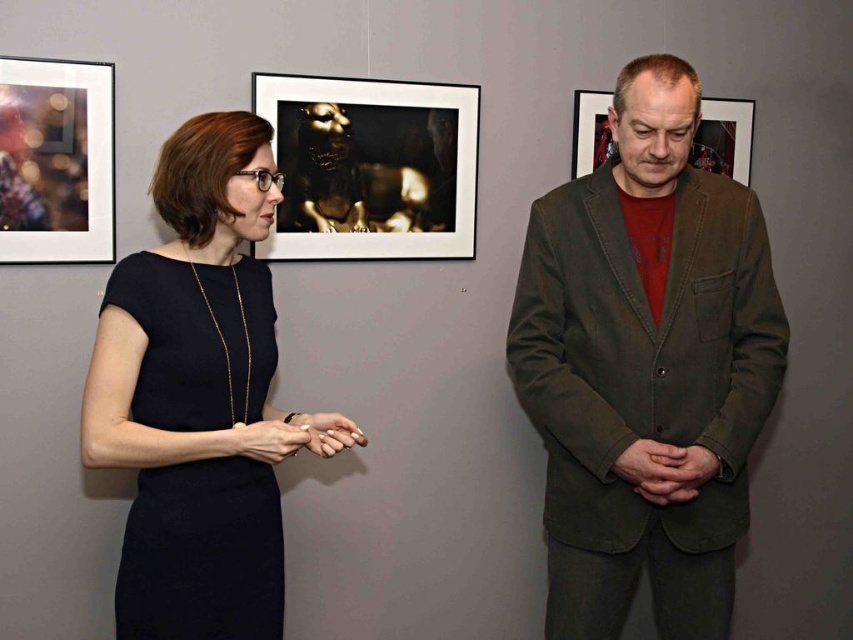
Question: Among these points, which one is farthest from the camera?

Choices:
 (A) (640, 275)
 (B) (265, 456)
 (C) (260, 243)

Answer: (C)

Question: Which of the following is the closest to the observer?

Choices:
 (A) metallic glass frame at upper left
 (B) black matte dress at left
 (C) matte black hand at center
 (D) matte brown frame at center

Answer: (B)

Question: Is dark olive corduroy blazer at center further to the viewer compared to metallic gold sculpture at upper center?

Choices:
 (A) no
 (B) yes

Answer: (A)

Question: Can you confirm if metallic glass frame at upper left is wider than matte black hand at center?

Choices:
 (A) no
 (B) yes

Answer: (B)

Question: Which object is positioned closest to the matte black hand at center?

Choices:
 (A) black matte dress at left
 (B) metallic gold sculpture at upper center

Answer: (A)

Question: Does metallic gold sculpture at upper center have a smaller size compared to metallic glass frame at upper left?

Choices:
 (A) no
 (B) yes

Answer: (A)